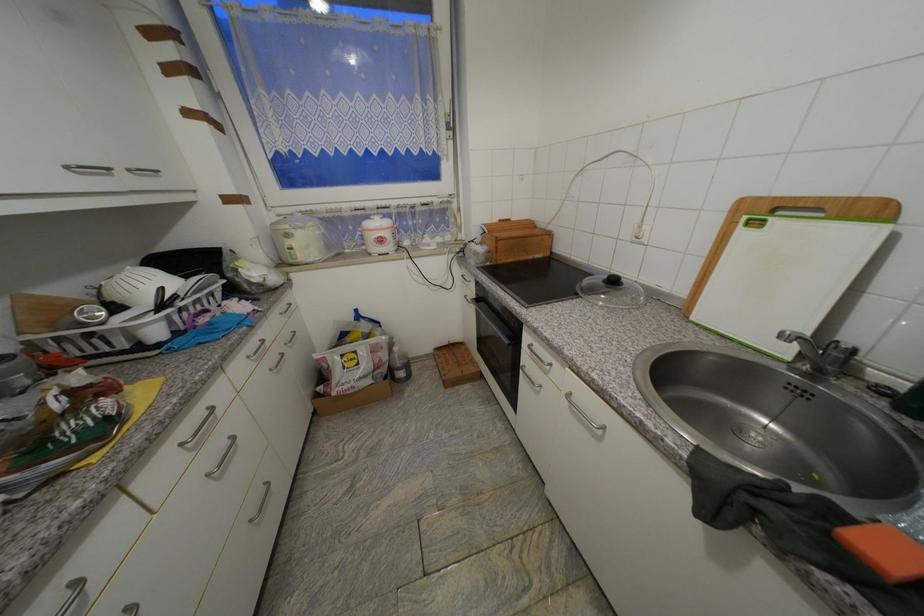
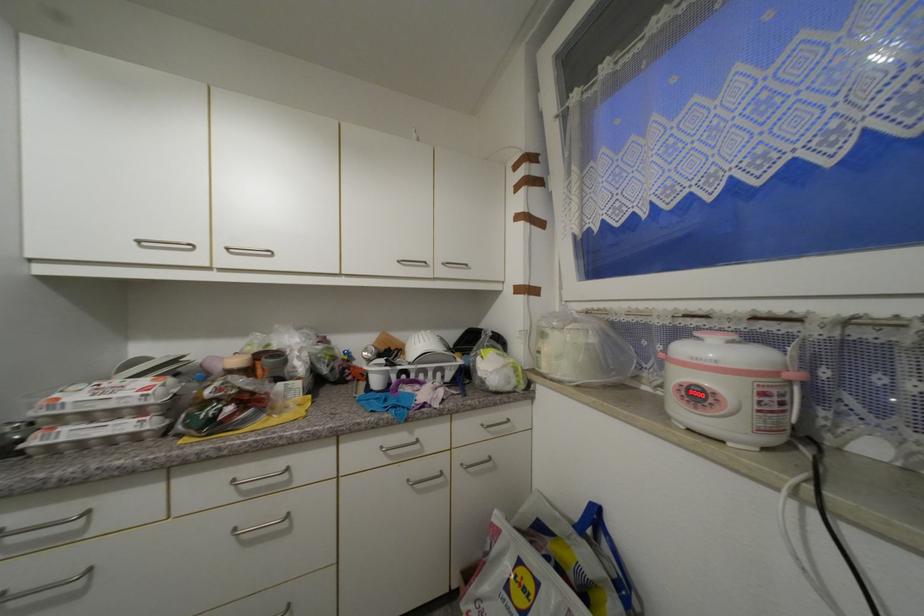
The point at (383, 323) is marked in the first image. Where is the corresponding point in the second image?

(636, 588)